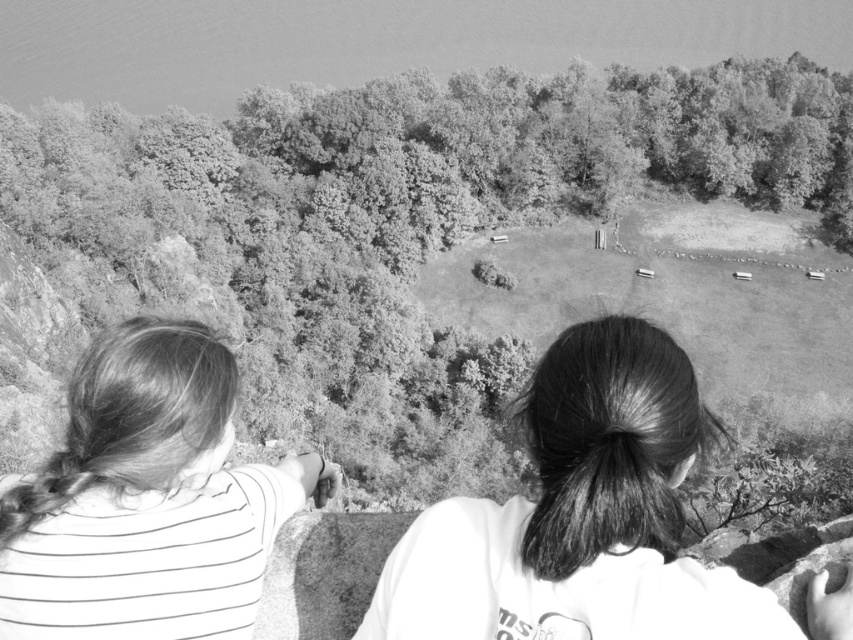
In the scene shown: You are a photographer trying to capture a clear shot of both the striped fabric hair at left and the smooth green tree at center. Based on their positions, which object should you focus on first to ensure both are in the frame?

The striped fabric hair at left is behind the smooth green tree at center, so you should focus on the smooth green tree at center first to ensure both are in the frame.

Based on the scene described, which object is taller between the smooth green tree at center and the striped fabric hair at left?

The smooth green tree at center is taller than the striped fabric hair at left.